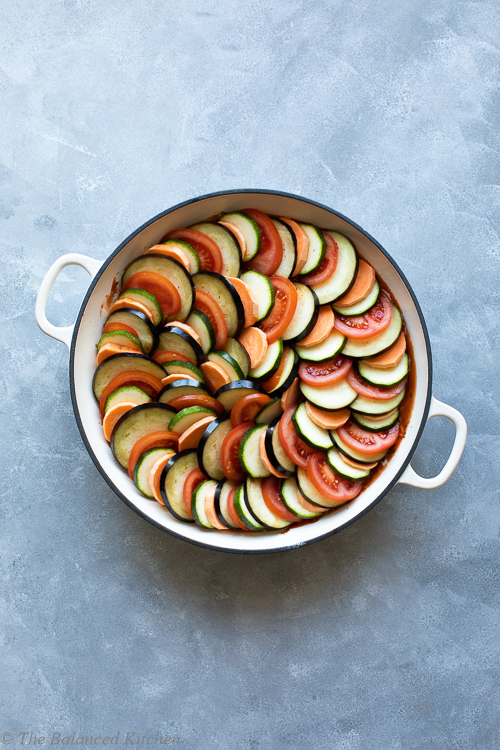
Where is `white pot`? The height and width of the screenshot is (750, 500). white pot is located at coordinates (91, 327).